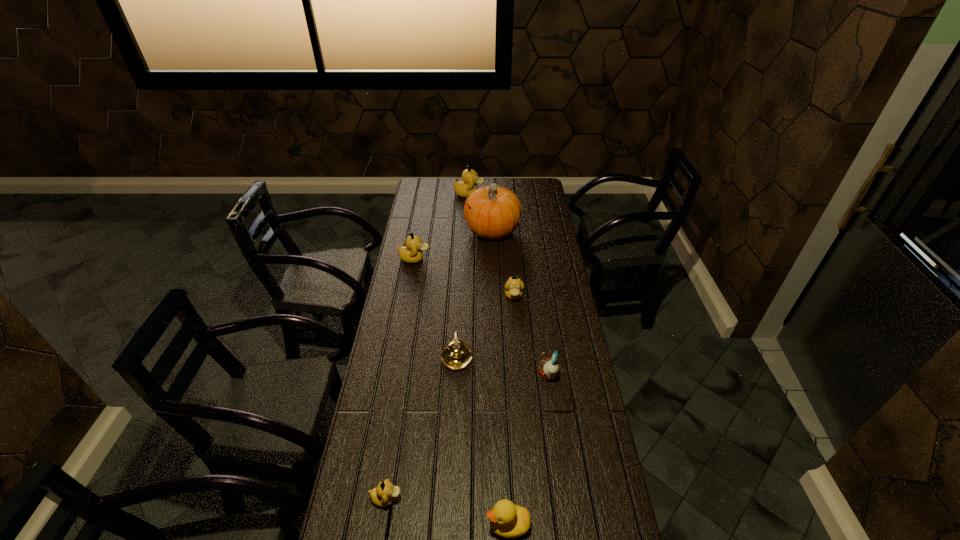
Identify the location of pink muffin. (549, 368).

You are a GUI agent. You are given a task and a screenshot of the screen. Output one action in this format:
    pyautogui.click(x=<x>, y=<y>)
    Task: Click on the shortest duckling
    This screenshot has height=540, width=960.
    Given the screenshot: What is the action you would take?
    pyautogui.click(x=383, y=495)

Where is `the nearest tan duckling`? the nearest tan duckling is located at coordinates (383, 495).

Find the location of a particular element. The width and height of the screenshot is (960, 540). free space located on the front-facing side of the pumpkin is located at coordinates (408, 231).

This screenshot has height=540, width=960. Identify the location of free space located on the front-facing side of the pumpkin. (414, 231).

I want to click on vacant space located on the front-facing side of the pumpkin, so click(451, 231).

This screenshot has width=960, height=540. Find the location of `vacant area situated 0.070m on the face of the second tan duckling from right to left`. vacant area situated 0.070m on the face of the second tan duckling from right to left is located at coordinates (496, 194).

You are a GUI agent. You are given a task and a screenshot of the screen. Output one action in this format:
    pyautogui.click(x=<x>, y=<y>)
    Task: Click on the vacant region located 0.160m on the face of the fourth shortest duckling
    
    Given the screenshot: What is the action you would take?
    pyautogui.click(x=464, y=259)

Find the location of a particular element. This screenshot has height=540, width=960. vacant space situated on the handle side of the candle holder is located at coordinates (461, 275).

Identify the location of vacant space positioned on the handle side of the candle holder. This screenshot has width=960, height=540. (460, 295).